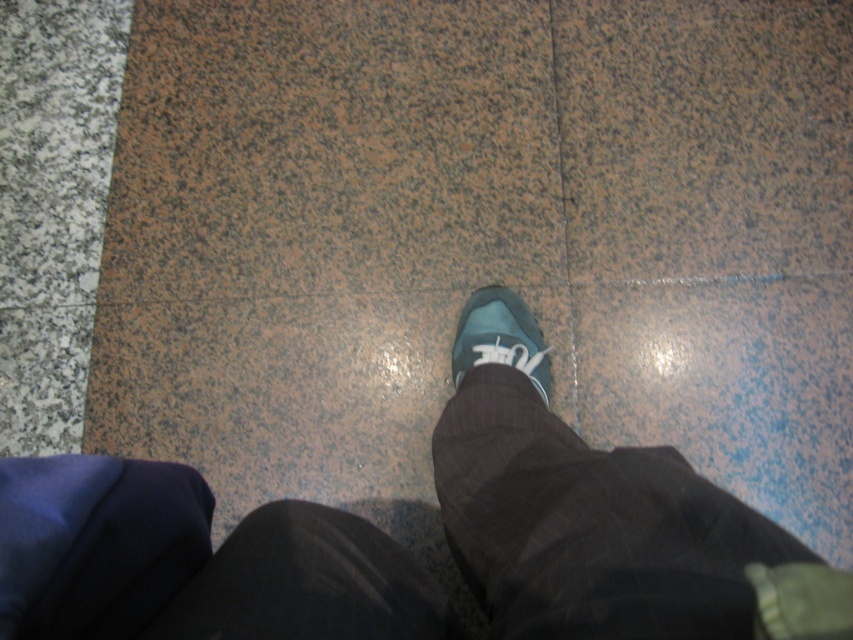
Question: Does matte blue shoe at center appear under matte blue sneaker at center?

Choices:
 (A) yes
 (B) no

Answer: (A)

Question: Which object is farther from the camera taking this photo?

Choices:
 (A) matte blue sneaker at center
 (B) matte blue shoe at center

Answer: (A)

Question: From the image, what is the correct spatial relationship of matte blue shoe at center in relation to matte blue sneaker at center?

Choices:
 (A) right
 (B) left

Answer: (B)

Question: Can you confirm if matte blue shoe at center is smaller than matte blue sneaker at center?

Choices:
 (A) no
 (B) yes

Answer: (A)

Question: Among these objects, which one is farthest from the camera?

Choices:
 (A) matte blue shoe at center
 (B) matte blue sneaker at center

Answer: (B)